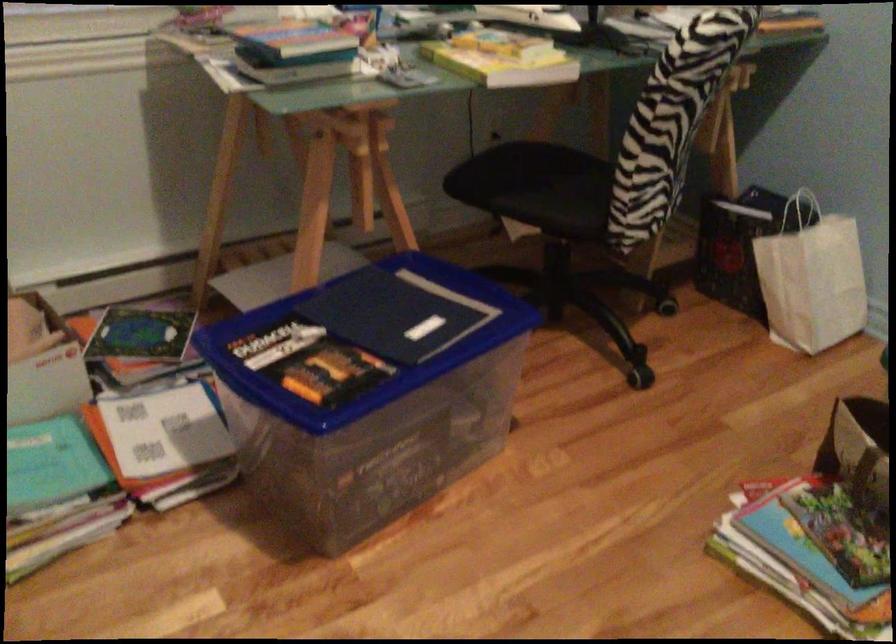
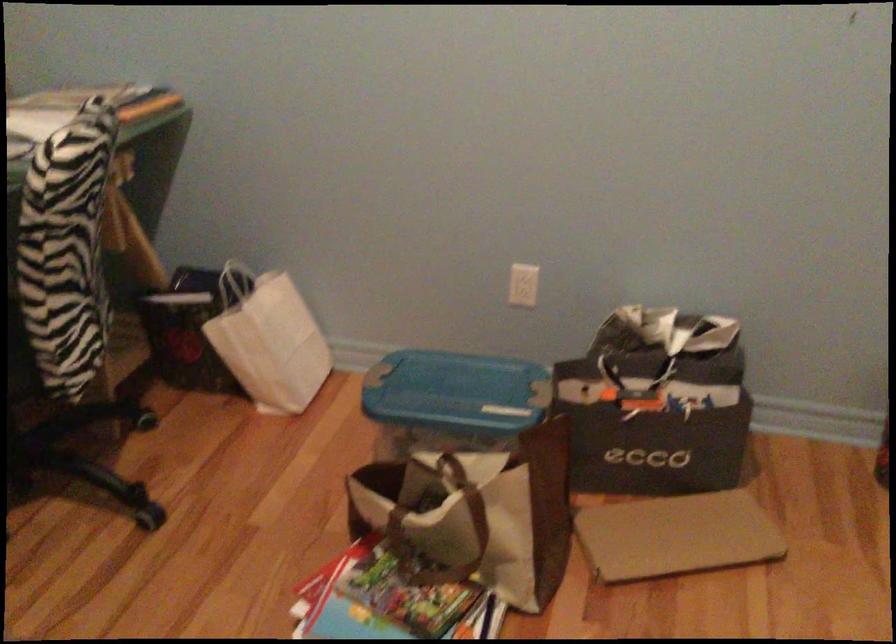
Where in the second image is the point corresponding to pixel 821 531 from the first image?

(388, 601)